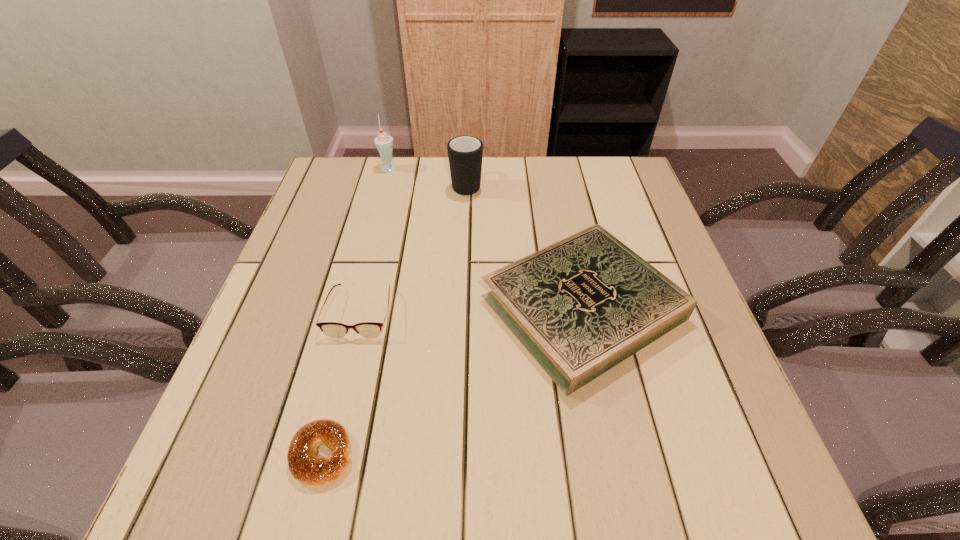
Identify the location of object that ranks as the fourth closest to the mug. This screenshot has height=540, width=960. (306, 466).

Locate an element on the screen. This screenshot has width=960, height=540. free location that satisfies the following two spatial constraints: 1. on the straw side of the milkshake; 2. on the side of the mug with the handle is located at coordinates (384, 184).

Where is `vacant area in the image that satisfies the following two spatial constraints: 1. on the straw side of the milkshake; 2. on the left side of the hardback book`? The image size is (960, 540). vacant area in the image that satisfies the following two spatial constraints: 1. on the straw side of the milkshake; 2. on the left side of the hardback book is located at coordinates (352, 307).

Locate an element on the screen. vacant position in the image that satisfies the following two spatial constraints: 1. on the straw side of the milkshake; 2. on the side of the mug with the handle is located at coordinates (384, 184).

Find the location of a particular element. Image resolution: width=960 pixels, height=540 pixels. vacant space that satisfies the following two spatial constraints: 1. on the straw side of the milkshake; 2. on the side of the mug with the handle is located at coordinates (384, 184).

The image size is (960, 540). In order to click on vacant space that satisfies the following two spatial constraints: 1. on the back side of the nearest object; 2. on the right side of the hardback book in this screenshot , I will do pyautogui.click(x=360, y=307).

The height and width of the screenshot is (540, 960). Find the location of `free location that satisfies the following two spatial constraints: 1. on the straw side of the milkshake; 2. on the left side of the hardback book`. free location that satisfies the following two spatial constraints: 1. on the straw side of the milkshake; 2. on the left side of the hardback book is located at coordinates (352, 307).